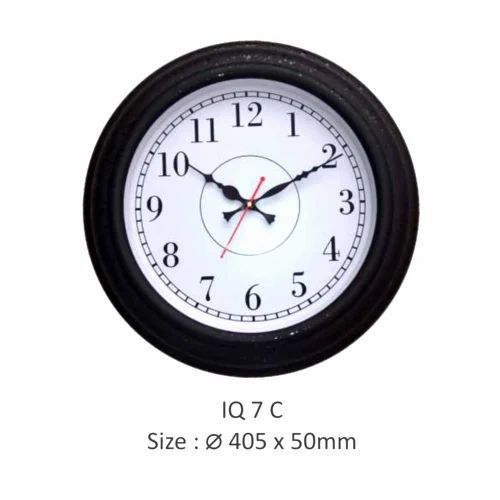
At what (x,y) coordinates should I click in order to perform the action: click on circle around middle of clock. Please return your answer as a coordinate pair (x, y). This screenshot has height=500, width=500. Looking at the image, I should click on (283, 243).